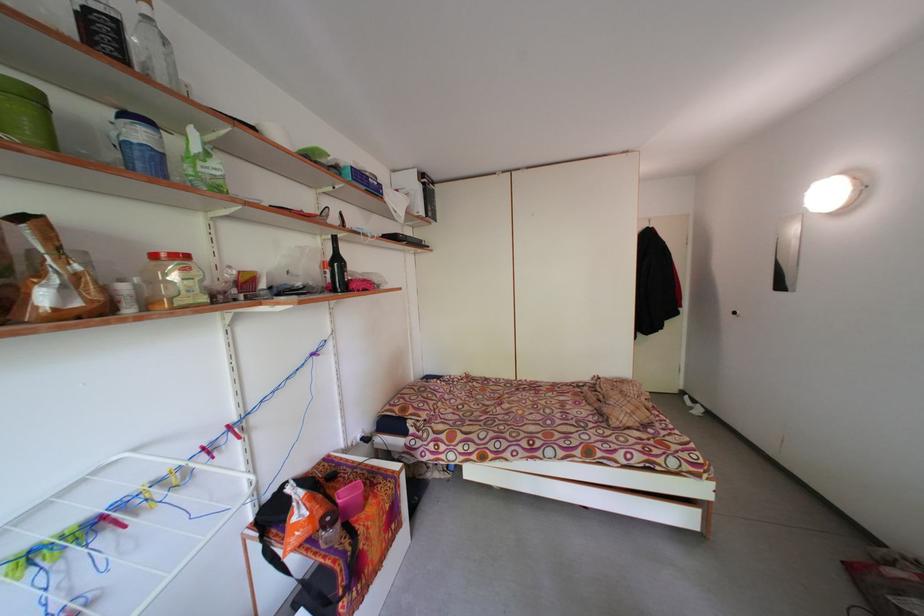
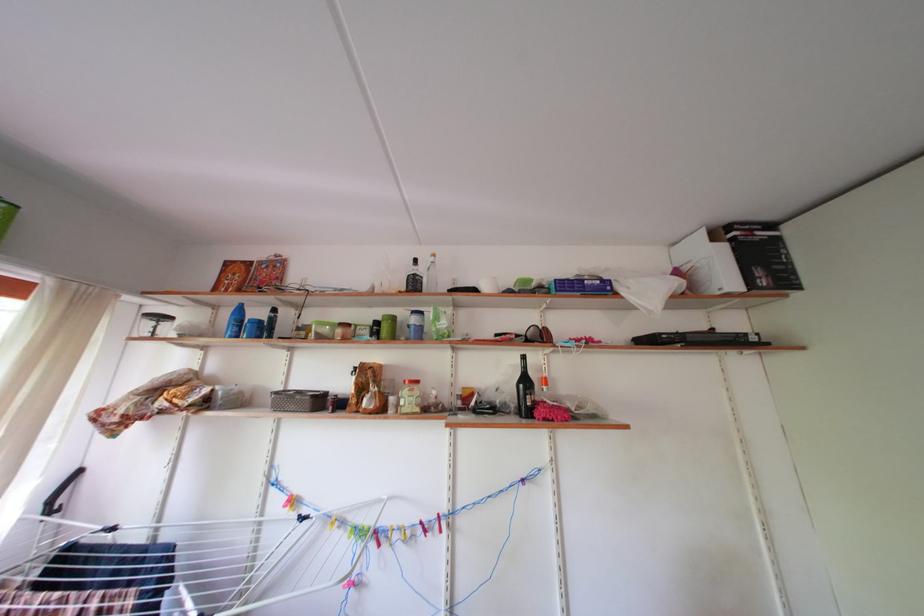
Question: The camera is either moving clockwise (left) or counter-clockwise (right) around the object. The first image is from the beginning of the video and the second image is from the end. Is the camera moving left or right when shooting the video?

Choices:
 (A) Left
 (B) Right

Answer: (B)